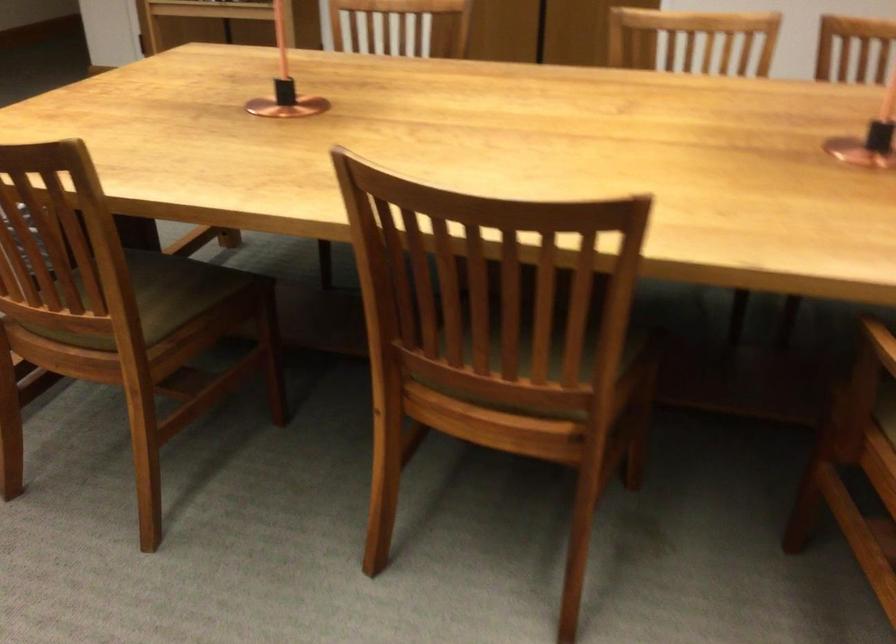
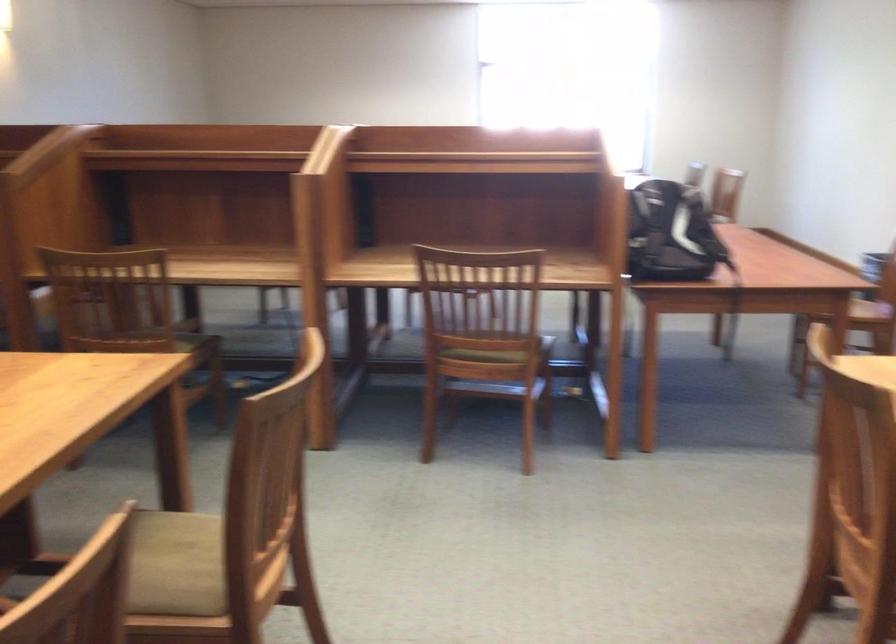
Question: The first image is from the beginning of the video and the second image is from the end. How did the camera likely rotate when shooting the video?

Choices:
 (A) Left
 (B) Right
 (C) Up
 (D) Down

Answer: (A)